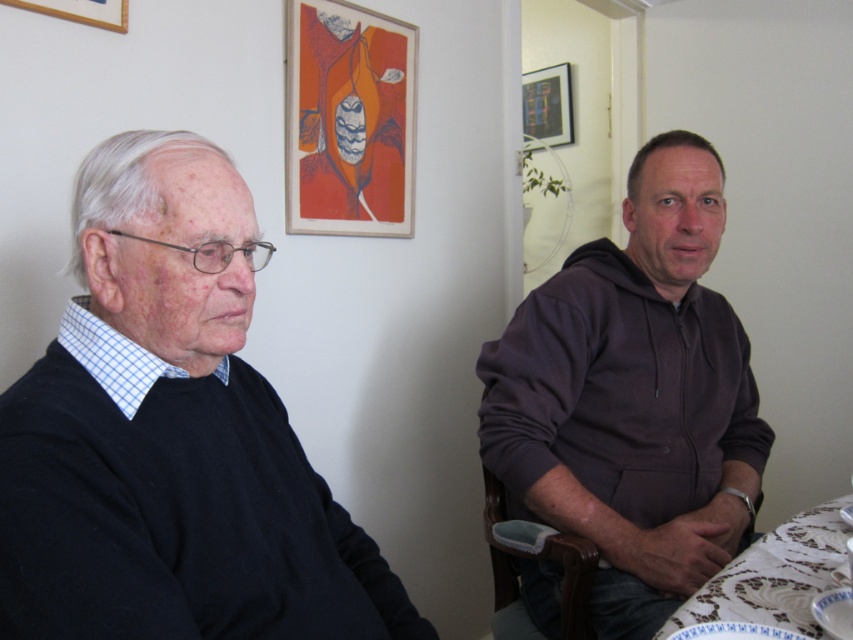
Is white lace tablecloth at lower right thinner than wooden picture frame at upper left?

Incorrect, white lace tablecloth at lower right's width is not less than wooden picture frame at upper left's.

Which is more to the left, white lace tablecloth at lower right or wooden picture frame at upper left?

wooden picture frame at upper left

Is point (711, 582) closer to camera compared to point (91, 4)?

That is True.

Find the location of a particular element. This screenshot has height=640, width=853. white lace tablecloth at lower right is located at coordinates (775, 576).

Looking at this image, does black matte sweater at left appear under wooden picture frame at upper center?

Indeed, black matte sweater at left is positioned under wooden picture frame at upper center.

Is black matte sweater at left taller than wooden picture frame at upper center?

Yes.

Between point (331, 561) and point (521, 90), which one is positioned behind?

Positioned behind is point (521, 90).

Identify the location of black matte sweater at left. This screenshot has height=640, width=853. (171, 435).

Which of these two, wooden frame at upper center or white lace tablecloth at lower right, stands shorter?

white lace tablecloth at lower right is shorter.

Does wooden frame at upper center have a smaller size compared to white lace tablecloth at lower right?

No.

Who is more distant from viewer, (302, 97) or (674, 624)?

The point (302, 97) is more distant.

I want to click on wooden frame at upper center, so point(349,120).